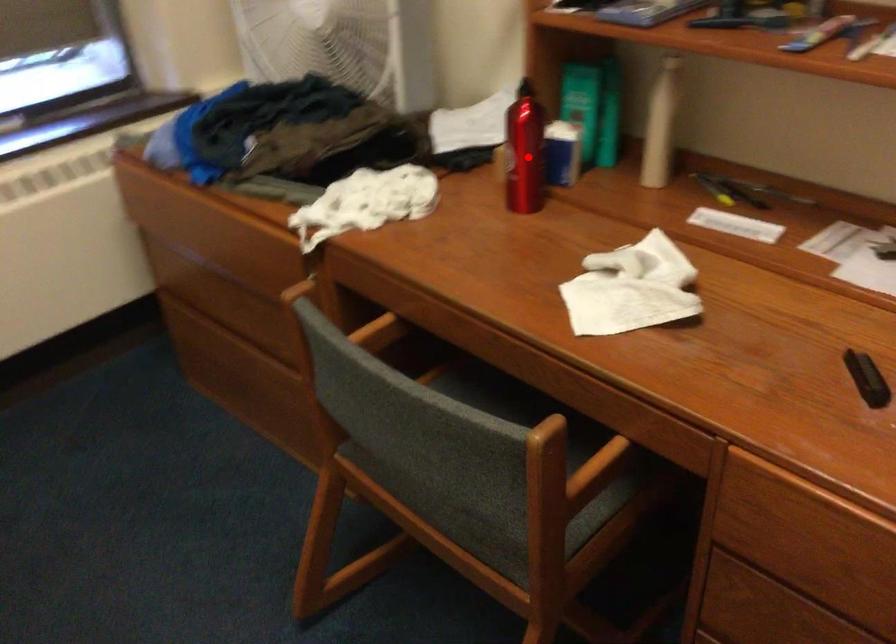
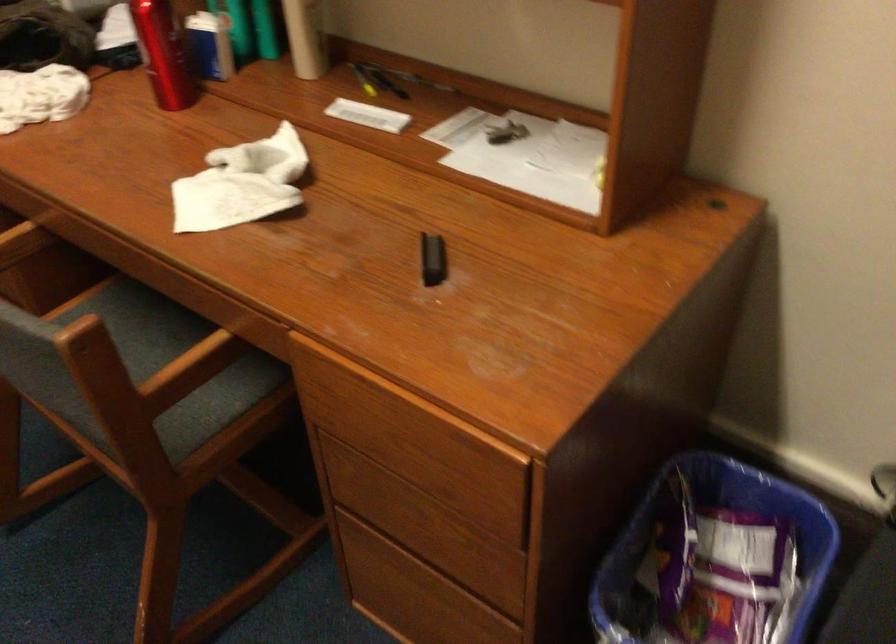
Locate, in the second image, the point that corresponds to the highlighted location in the first image.

(162, 53)